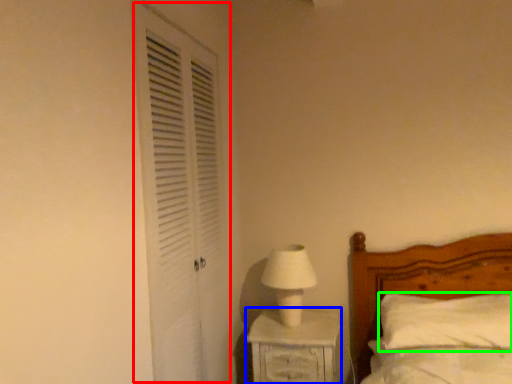
Question: Based on their relative distances, which object is farther from screen door (highlighted by a red box)? Choose from nightstand (highlighted by a blue box) and pillow (highlighted by a green box).

Choices:
 (A) nightstand
 (B) pillow

Answer: (B)